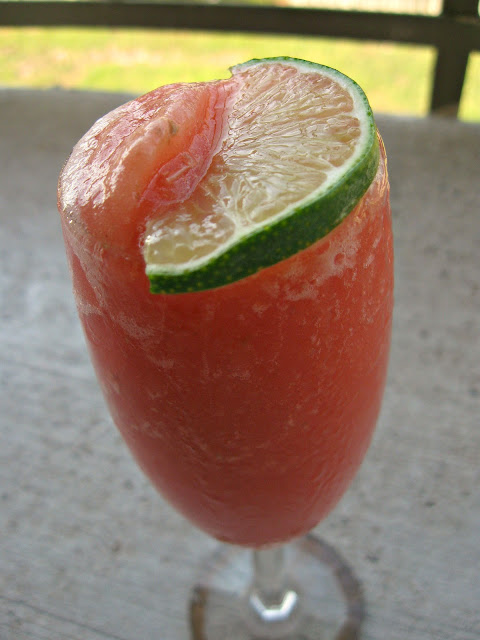
Find the location of a particular element. The width and height of the screenshot is (480, 640). wine glass stem is located at coordinates (272, 557), (271, 586).